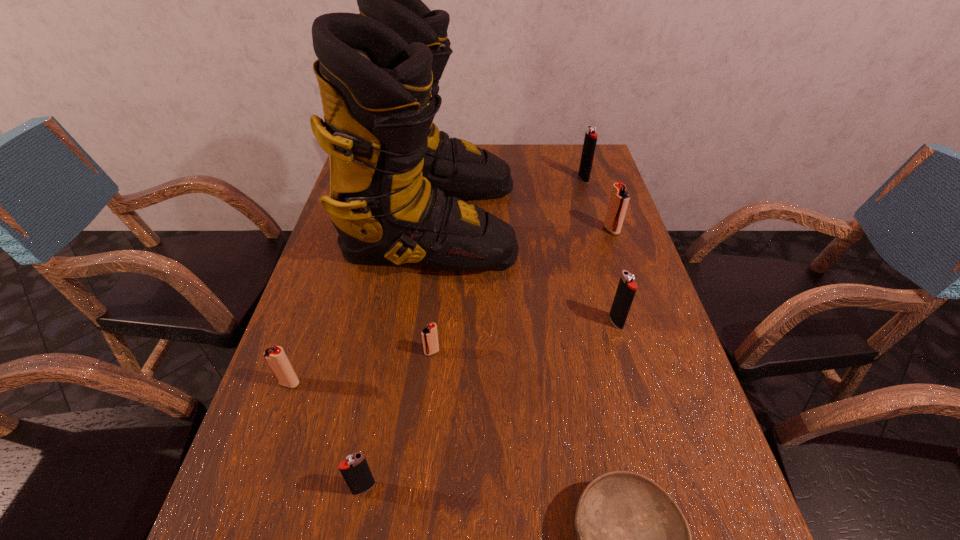
You are a GUI agent. You are given a task and a screenshot of the screen. Output one action in this format:
    pyautogui.click(x=<x>, y=<y>)
    Task: Click on the tallest object
    
    Given the screenshot: What is the action you would take?
    pyautogui.click(x=397, y=184)

At what (x,y) coordinates should I click in order to perform the action: click on the second tallest object. Please return your answer as a coordinate pair (x, y). Looking at the image, I should click on pyautogui.click(x=590, y=140).

Find the location of a particular element. the tallest igniter is located at coordinates (590, 140).

Identify the location of the rightmost object. (619, 199).

At what (x,y) coordinates should I click in order to perform the action: click on the biggest red igniter. Please return your answer as a coordinate pair (x, y). Looking at the image, I should click on (619, 199).

What are the coordinates of `the second nearest black igniter` in the screenshot? It's located at (626, 289).

Find the location of `the second biggest black igniter`. the second biggest black igniter is located at coordinates (626, 289).

Where is `the second igniter from left to right`? This screenshot has width=960, height=540. the second igniter from left to right is located at coordinates (355, 470).

Find the location of a particular element. the nearest igniter is located at coordinates (x=355, y=470).

What are the coordinates of `the leftmost igniter` in the screenshot? It's located at (275, 356).